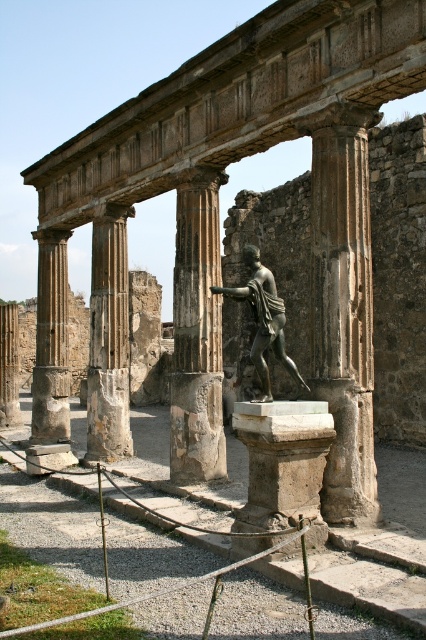
Question: In this image, where is brown stone column at center located relative to marble column at center?

Choices:
 (A) below
 (B) above

Answer: (A)

Question: Estimate the real-world distances between objects in this image. Which object is closer to the bronze statue at center?

Choices:
 (A) stone column at center
 (B) smooth stone column at center

Answer: (A)

Question: Which object appears farthest from the camera in this image?

Choices:
 (A) smooth stone column at center
 (B) smooth stone column at left

Answer: (A)

Question: Considering the relative positions of marble column at center and smooth stone column at left in the image provided, where is marble column at center located with respect to smooth stone column at left?

Choices:
 (A) below
 (B) above

Answer: (B)

Question: Does stone column at center appear over smooth stone column at center?

Choices:
 (A) no
 (B) yes

Answer: (B)

Question: Which point is closer to the camera?

Choices:
 (A) (213, 292)
 (B) (324, 336)
 (C) (60, 301)
 (D) (2, 412)

Answer: (B)